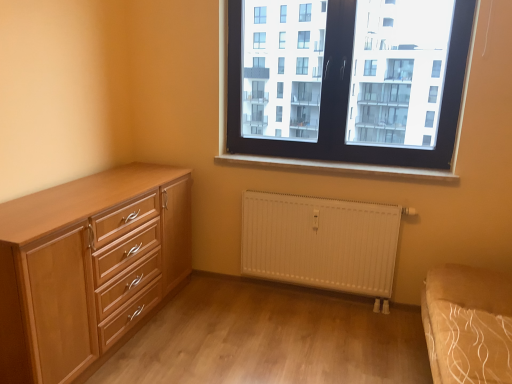
Question: Would you say white painted wood at center is outside white matte radiator at lower center?

Choices:
 (A) yes
 (B) no

Answer: (A)

Question: From a real-world perspective, is white painted wood at center positioned under white matte radiator at lower center based on gravity?

Choices:
 (A) yes
 (B) no

Answer: (B)

Question: From the image's perspective, is white painted wood at center under white matte radiator at lower center?

Choices:
 (A) yes
 (B) no

Answer: (B)

Question: Could you tell me if white painted wood at center is turned towards white matte radiator at lower center?

Choices:
 (A) yes
 (B) no

Answer: (B)

Question: Is white painted wood at center at the right side of white matte radiator at lower center?

Choices:
 (A) yes
 (B) no

Answer: (A)

Question: Is black plastic window at upper center situated inside white matte radiator at lower center or outside?

Choices:
 (A) inside
 (B) outside

Answer: (B)

Question: From the image's perspective, is black plastic window at upper center above or below white matte radiator at lower center?

Choices:
 (A) below
 (B) above

Answer: (B)

Question: Is black plastic window at upper center bigger or smaller than white matte radiator at lower center?

Choices:
 (A) big
 (B) small

Answer: (A)

Question: Considering the positions of point (285, 114) and point (359, 288), is point (285, 114) closer or farther from the camera than point (359, 288)?

Choices:
 (A) farther
 (B) closer

Answer: (A)

Question: From their relative heights in the image, would you say light wood chest of drawers at left is taller or shorter than black plastic window at upper center?

Choices:
 (A) short
 (B) tall

Answer: (A)

Question: From the image's perspective, is light wood chest of drawers at left located above or below black plastic window at upper center?

Choices:
 (A) above
 (B) below

Answer: (B)

Question: Is point (90, 316) positioned closer to the camera than point (286, 28)?

Choices:
 (A) closer
 (B) farther

Answer: (A)

Question: From a real-world perspective, relative to black plastic window at upper center, is light wood chest of drawers at left vertically above or below?

Choices:
 (A) above
 (B) below

Answer: (B)

Question: In terms of size, does white painted wood at center appear bigger or smaller than black plastic window at upper center?

Choices:
 (A) big
 (B) small

Answer: (B)

Question: Looking at their shapes, would you say white painted wood at center is wider or thinner than black plastic window at upper center?

Choices:
 (A) wide
 (B) thin

Answer: (A)